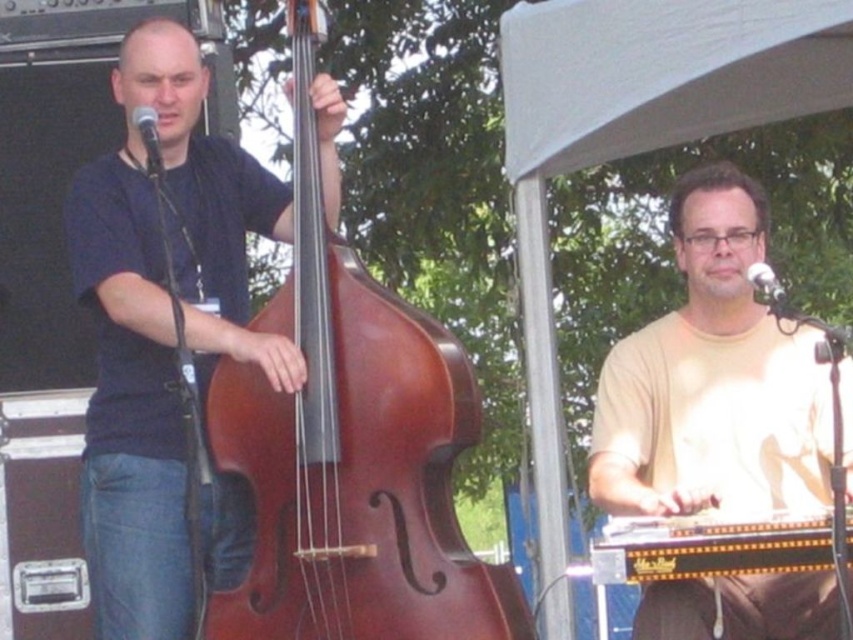
Can you confirm if light beige t-shirt at center is wider than metallic silver microphone at upper right?

Yes.

You are a GUI agent. You are given a task and a screenshot of the screen. Output one action in this format:
    pyautogui.click(x=<x>, y=<y>)
    Task: Click on the light beige t-shirt at center
    
    Given the screenshot: What is the action you would take?
    pyautogui.click(x=712, y=378)

Looking at this image, is matte black double bass at left taller than metallic silver microphone at upper right?

Correct, matte black double bass at left is much taller as metallic silver microphone at upper right.

From the picture: Can you confirm if matte black double bass at left is positioned above metallic silver microphone at upper right?

Incorrect, matte black double bass at left is not positioned above metallic silver microphone at upper right.

Image resolution: width=853 pixels, height=640 pixels. What do you see at coordinates (160, 326) in the screenshot?
I see `matte black double bass at left` at bounding box center [160, 326].

This screenshot has height=640, width=853. Identify the location of matte black double bass at left. (160, 326).

You are a GUI agent. You are given a task and a screenshot of the screen. Output one action in this format:
    pyautogui.click(x=<x>, y=<y>)
    Task: Click on the matte black double bass at left
    This screenshot has height=640, width=853.
    Given the screenshot: What is the action you would take?
    pyautogui.click(x=160, y=326)

Does point (207, 512) lie behind point (721, 413)?

Yes, it is behind point (721, 413).

Image resolution: width=853 pixels, height=640 pixels. Identify the location of matte black double bass at left. (160, 326).